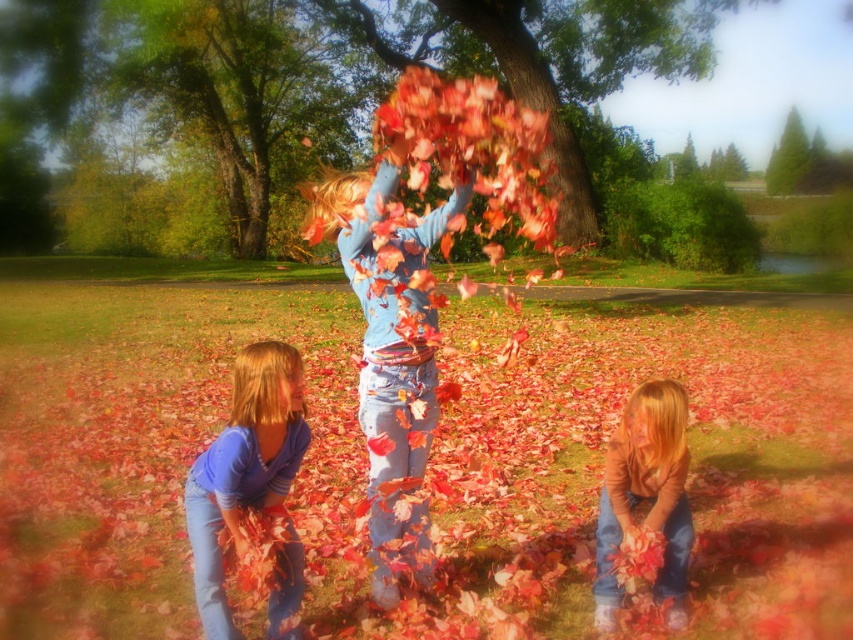
Can you confirm if matte blue shirt at center is positioned below matte brown sweater at lower right?

Actually, matte blue shirt at center is above matte brown sweater at lower right.

Between point (378, 541) and point (630, 428), which one is positioned behind?

Positioned behind is point (378, 541).

Which is in front, point (405, 323) or point (672, 385)?

Positioned in front is point (672, 385).

This screenshot has height=640, width=853. I want to click on matte blue shirt at center, so click(389, 346).

Which is above, green leafy tree at upper center or smooth bark tree at center?

Positioned higher is smooth bark tree at center.

Between point (293, 33) and point (524, 74), which one is positioned in front?

Positioned in front is point (524, 74).

Where is `green leafy tree at upper center`? green leafy tree at upper center is located at coordinates (228, 88).

In the scene shown: Is green leafy tree at upper center smaller than blue cotton shirt at lower left?

Incorrect, green leafy tree at upper center is not smaller in size than blue cotton shirt at lower left.

Does green leafy tree at upper center have a larger size compared to blue cotton shirt at lower left?

Correct, green leafy tree at upper center is larger in size than blue cotton shirt at lower left.

In order to click on green leafy tree at upper center in this screenshot , I will do [228, 88].